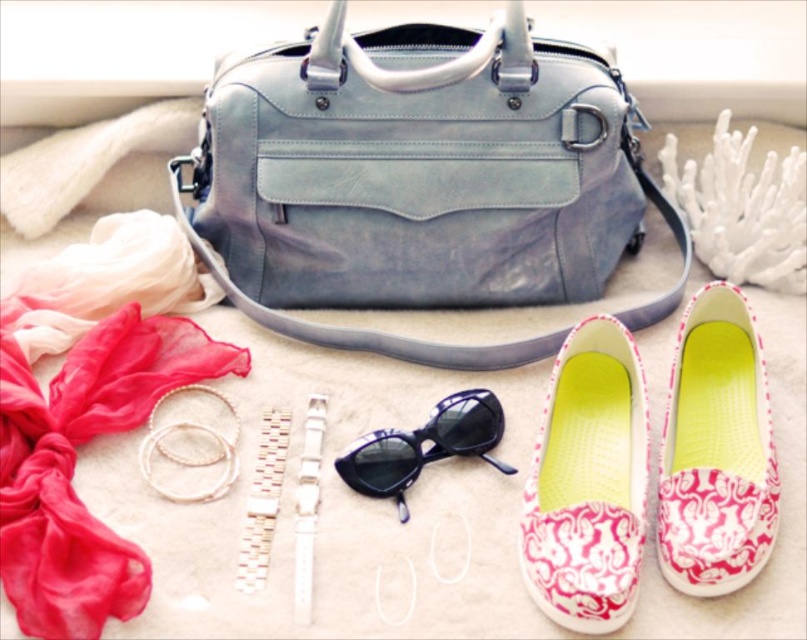
You are organizing a fashion show and need to decide which item to place on a small display stand. The stand can only hold items smaller than the other. Which item between the silky chiffon scarf at upper left and the black plastic sunglasses at center should you choose?

The black plastic sunglasses at center should be placed on the stand because it is smaller than the silky chiffon scarf at upper left.